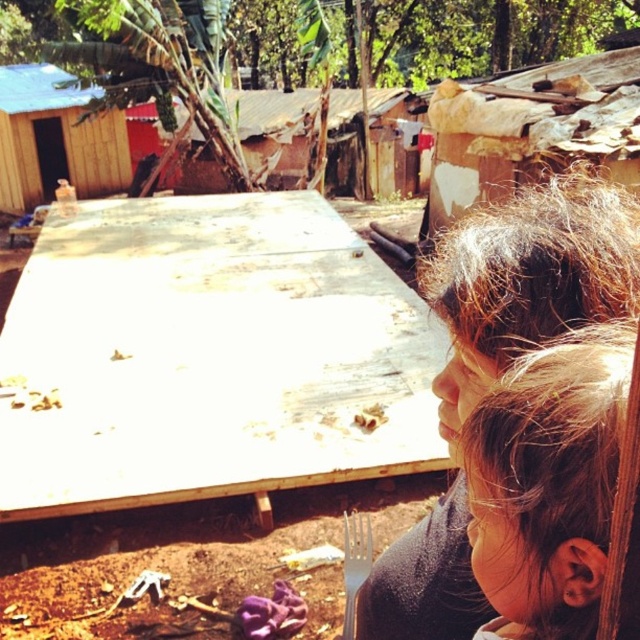
Question: Can you confirm if brown hair at upper right is positioned to the right of rusty corrugated metal hut at upper right?

Choices:
 (A) no
 (B) yes

Answer: (A)

Question: Which of the following is the farthest from the observer?

Choices:
 (A) dark brown hair at upper right
 (B) brown hair at upper right
 (C) silver metallic fork at lower center
 (D) wooden hut at left

Answer: (D)

Question: Which object is closer to the camera taking this photo?

Choices:
 (A) dark brown hair at upper right
 (B) rusty corrugated metal hut at upper right

Answer: (A)

Question: Does dark brown hair at upper right have a larger size compared to wooden hut at left?

Choices:
 (A) yes
 (B) no

Answer: (B)

Question: Does rusty corrugated metal hut at center have a larger size compared to silver metallic fork at lower center?

Choices:
 (A) no
 (B) yes

Answer: (B)

Question: Which point appears farthest from the camera in this image?

Choices:
 (A) pos(209,179)
 (B) pos(54,145)

Answer: (A)